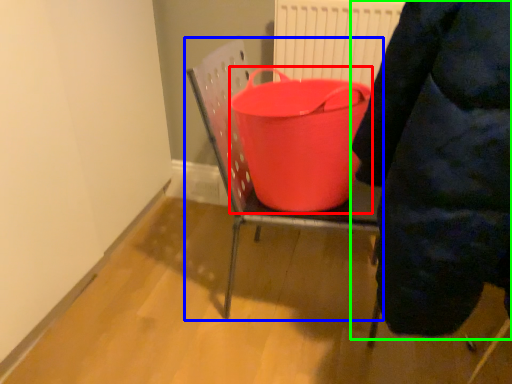
Question: Based on their relative distances, which object is nearer to basin (highlighted by a red box)? Choose from furniture (highlighted by a blue box) and person (highlighted by a green box).

Choices:
 (A) furniture
 (B) person

Answer: (A)